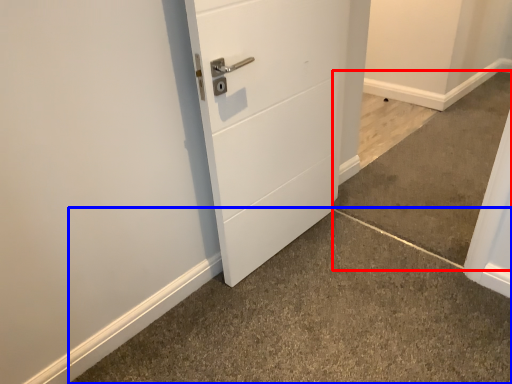
Question: Which of the following is the closest to the observer, concrete (highlighted by a red box) or concrete (highlighted by a blue box)?

Choices:
 (A) concrete
 (B) concrete

Answer: (B)